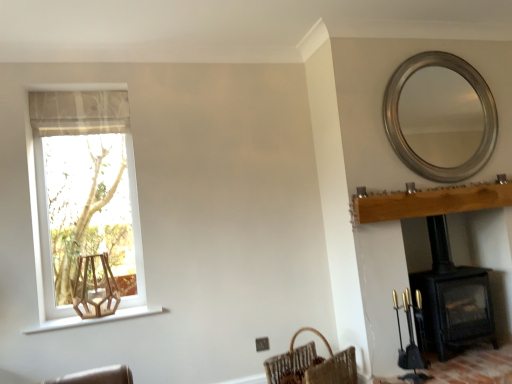
Question: Can you confirm if wooden hexagonal swivel chair at lower left is taller than light brown wood mantle at upper right?

Choices:
 (A) no
 (B) yes

Answer: (B)

Question: Is wooden hexagonal swivel chair at lower left facing away from light brown wood mantle at upper right?

Choices:
 (A) no
 (B) yes

Answer: (A)

Question: Is the surface of wooden hexagonal swivel chair at lower left in direct contact with light brown wood mantle at upper right?

Choices:
 (A) no
 (B) yes

Answer: (A)

Question: Are wooden hexagonal swivel chair at lower left and light brown wood mantle at upper right far apart?

Choices:
 (A) yes
 (B) no

Answer: (A)

Question: Could you tell me if wooden hexagonal swivel chair at lower left is turned towards light brown wood mantle at upper right?

Choices:
 (A) no
 (B) yes

Answer: (A)

Question: Considering the relative sizes of wooden hexagonal swivel chair at lower left and light brown wood mantle at upper right in the image provided, is wooden hexagonal swivel chair at lower left thinner than light brown wood mantle at upper right?

Choices:
 (A) no
 (B) yes

Answer: (A)

Question: Is brown woven basket at lower right to the right of light brown wood mantle at upper right from the viewer's perspective?

Choices:
 (A) yes
 (B) no

Answer: (B)

Question: Is brown woven basket at lower right shorter than light brown wood mantle at upper right?

Choices:
 (A) no
 (B) yes

Answer: (A)

Question: From a real-world perspective, does brown woven basket at lower right stand above light brown wood mantle at upper right?

Choices:
 (A) yes
 (B) no

Answer: (B)

Question: Is brown woven basket at lower right positioned before light brown wood mantle at upper right?

Choices:
 (A) no
 (B) yes

Answer: (B)

Question: Is brown woven basket at lower right thinner than light brown wood mantle at upper right?

Choices:
 (A) yes
 (B) no

Answer: (B)

Question: Is brown woven basket at lower right next to light brown wood mantle at upper right?

Choices:
 (A) no
 (B) yes

Answer: (A)

Question: Is wooden hexagonal swivel chair at lower left at the right side of black matte wood burning stove at lower right?

Choices:
 (A) yes
 (B) no

Answer: (B)